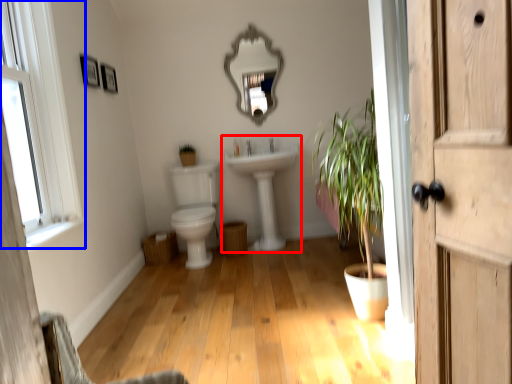
Question: Which object appears farthest to the camera in this image, sink (highlighted by a red box) or window (highlighted by a blue box)?

Choices:
 (A) sink
 (B) window

Answer: (A)